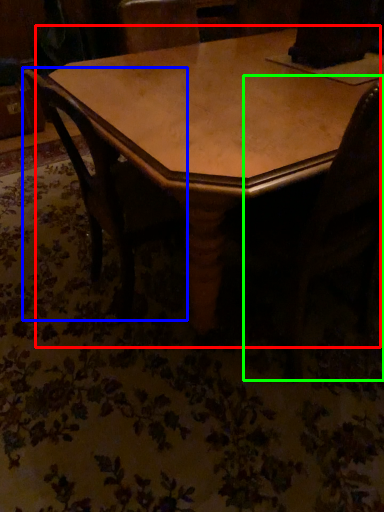
Question: Which is nearer to the table (highlighted by a red box)? chair (highlighted by a blue box) or swivel chair (highlighted by a green box).

Choices:
 (A) chair
 (B) swivel chair

Answer: (A)